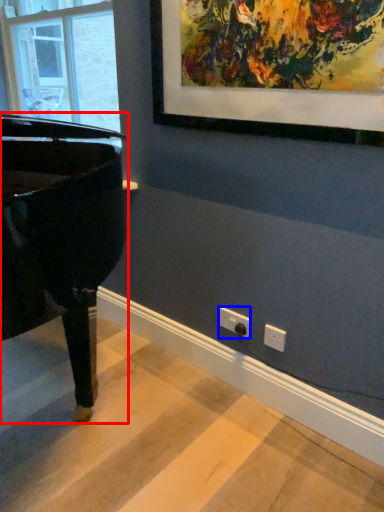
Question: Which object appears closest to the camera in this image, piano (highlighted by a red box) or electric outlet (highlighted by a blue box)?

Choices:
 (A) piano
 (B) electric outlet

Answer: (A)